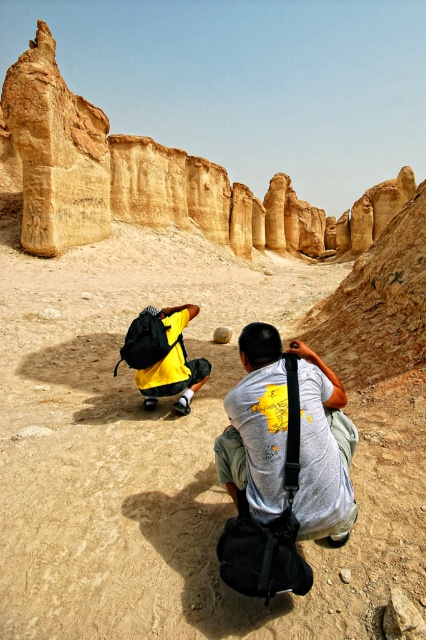
Question: Considering the relative positions of smooth sandstone rock at center and smooth beige rock at center in the image provided, where is smooth sandstone rock at center located with respect to smooth beige rock at center?

Choices:
 (A) below
 (B) above

Answer: (B)

Question: Which of the following is the farthest from the observer?

Choices:
 (A) gray matte t-shirt at center
 (B) smooth beige rock at center
 (C) yellow matte backpack at center
 (D) smooth sandstone rock at center

Answer: (B)

Question: Which of the following is the farthest from the observer?

Choices:
 (A) sandstone rock formation at upper left
 (B) smooth sandstone rock at center

Answer: (A)

Question: Which of the following is the farthest from the observer?

Choices:
 (A) smooth beige rock at center
 (B) smooth sandstone rock at center
 (C) yellow matte backpack at center
 (D) sandstone rock formation at upper left

Answer: (D)

Question: Is smooth sandstone rock at center closer to the viewer compared to gray matte t-shirt at center?

Choices:
 (A) no
 (B) yes

Answer: (B)

Question: Where is sandstone rock formation at upper left located in relation to smooth beige rock at center in the image?

Choices:
 (A) left
 (B) right

Answer: (B)